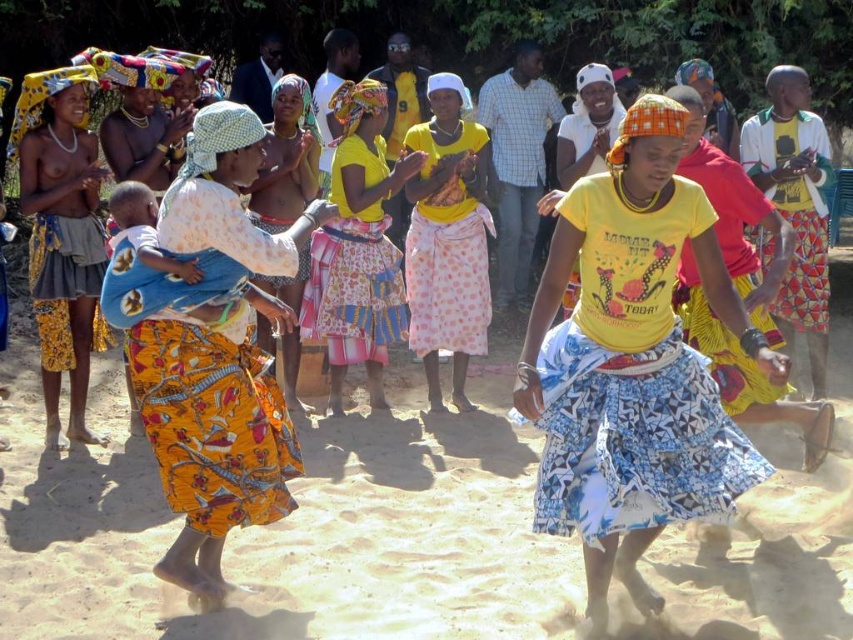
Question: Which point is farther to the camera?

Choices:
 (A) yellow printed shirt at center
 (B) yellow printed fabric at center

Answer: (A)

Question: Is yellow printed t-shirt at center smaller than yellow printed fabric skirt at center?

Choices:
 (A) no
 (B) yes

Answer: (B)

Question: In this image, where is matte yellow fabric skirt at left located relative to yellow printed fabric at center?

Choices:
 (A) right
 (B) left

Answer: (B)

Question: Which point is closer to the camera?

Choices:
 (A) (436, 93)
 (B) (548, 193)
 (C) (619, 404)
 (D) (366, 172)

Answer: (C)

Question: Is yellow printed fabric skirt at center wider than yellow printed shirt at center?

Choices:
 (A) yes
 (B) no

Answer: (A)

Question: Which of the following is the closest to the observer?

Choices:
 (A) yellow cotton skirt at center
 (B) yellow printed shirt at center
 (C) yellow printed fabric skirt at center

Answer: (C)